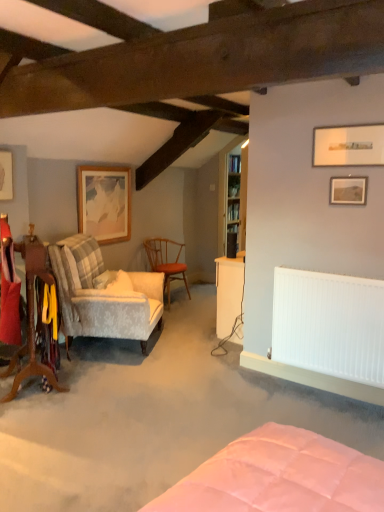
You are a GUI agent. You are given a task and a screenshot of the screen. Output one action in this format:
    pyautogui.click(x=<x>, y=<y>)
    Task: Click on the free spot above wooden framed artwork at upper left, the third picture frame when ordered from right to left (from a real-world perspective)
    The height and width of the screenshot is (512, 384).
    Given the screenshot: What is the action you would take?
    pyautogui.click(x=102, y=166)